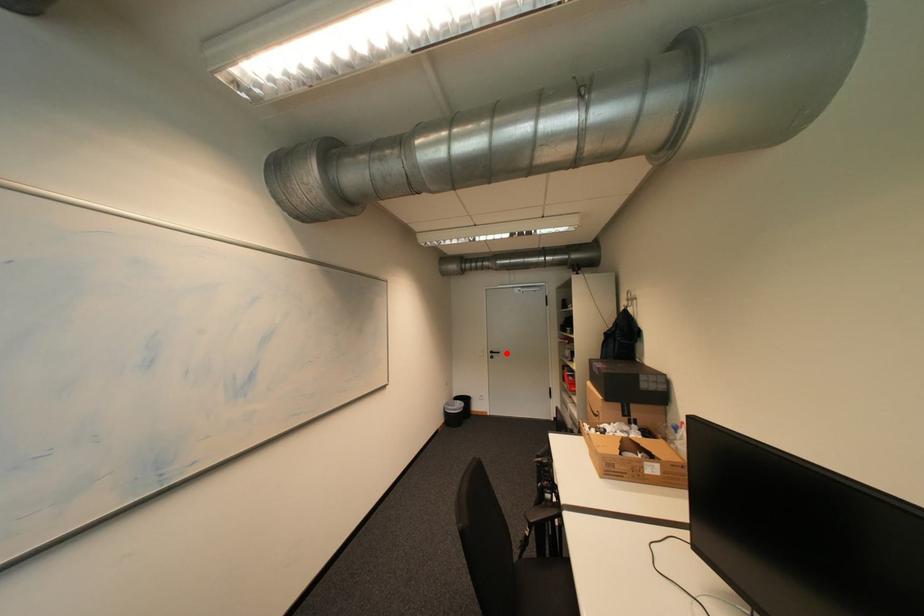
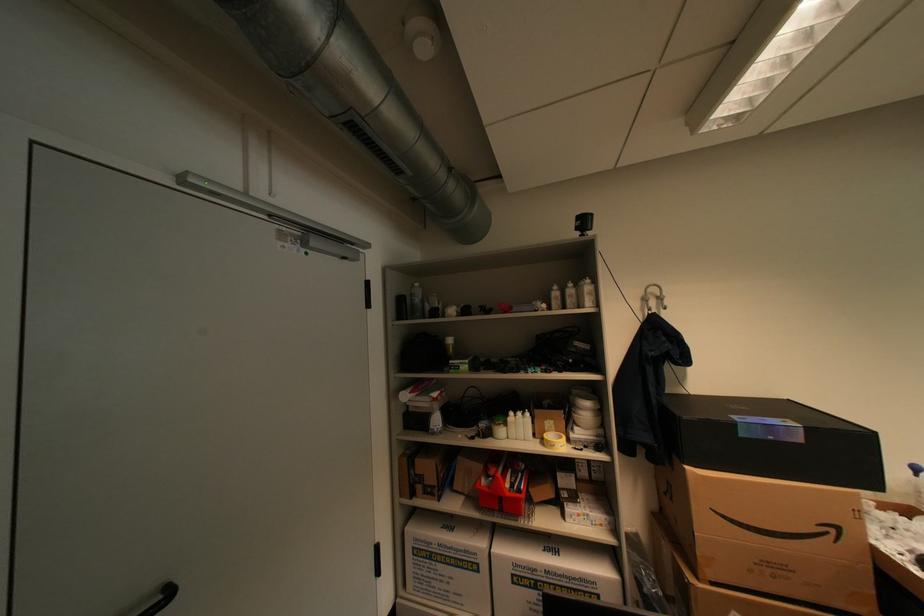
In the second image, find the point that corresponds to the highlighted location in the first image.

(176, 594)